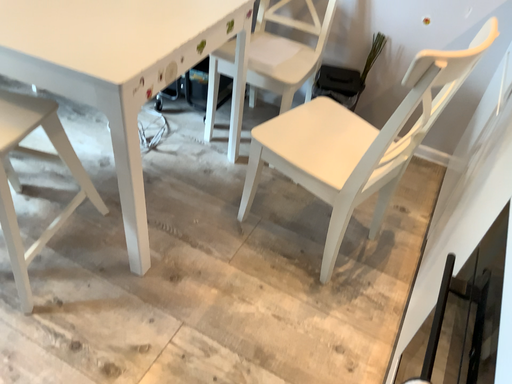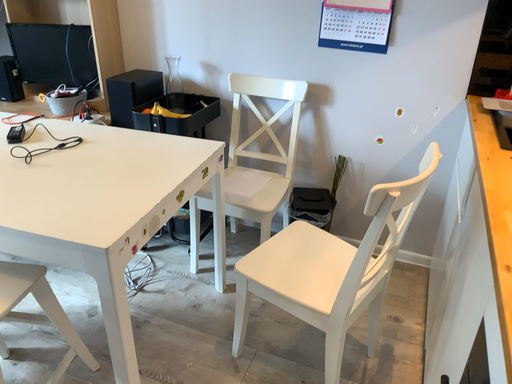
Question: Which way did the camera rotate in the video?

Choices:
 (A) rotated downward
 (B) rotated upward

Answer: (B)